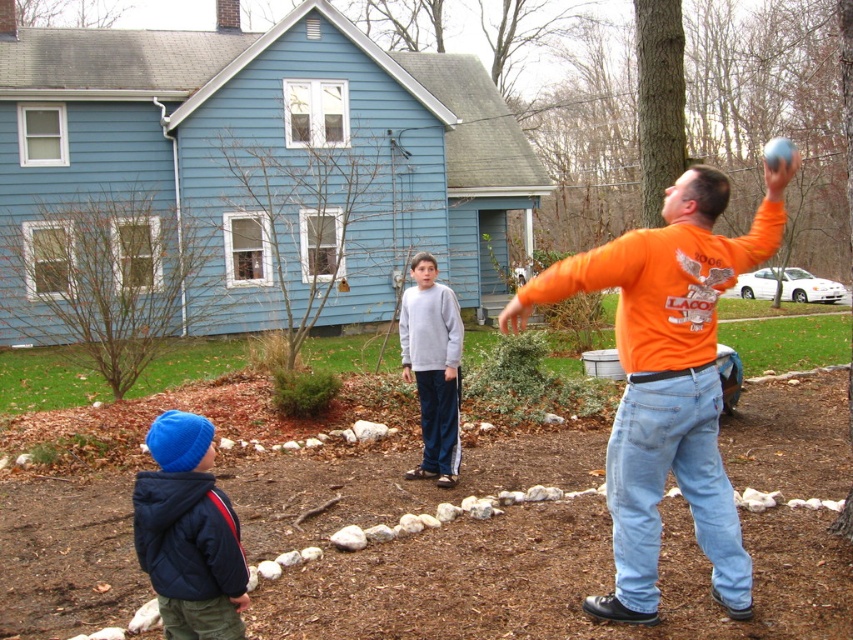
You are a photographer trying to capture a group photo of the orange cotton shirt at right and the matte blue beanie at lower left. Since you want to ensure both subjects are in focus, you need to know their height difference. Can you tell me which one is taller?

The orange cotton shirt at right is much taller than the matte blue beanie at lower left, so you should adjust your camera angle to account for the height difference between the two subjects.

You are a photographer trying to capture a photo of the orange cotton shirt at right and the gray sweatshirt at center. Based on their positions, which one should you focus on first to ensure both are in the frame?

The orange cotton shirt at right is above the gray sweatshirt at center, so you should focus on the gray sweatshirt at center first to ensure both are within the frame.